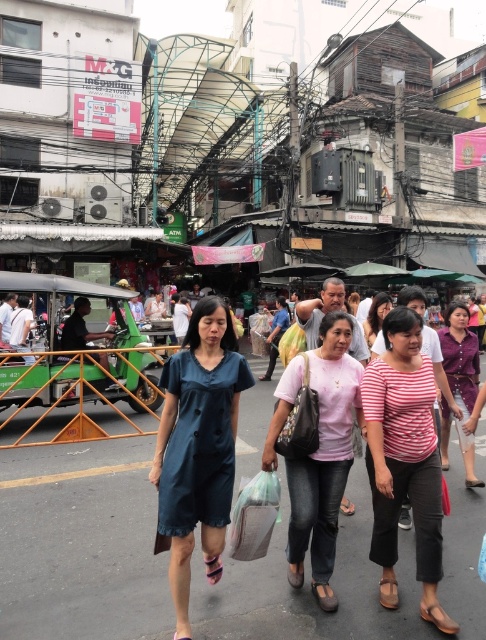
You are a street vendor trying to sell shirts to the two women in the center of the image. The striped cotton shirt at center and the pink cotton shirt at center are your best sellers. Which shirt should you approach first to maximize your sales?

You should approach the pink cotton shirt at center first because it is positioned to the left of the striped cotton shirt at center, making it closer to you from your vantage point as a vendor likely standing to the left of the scene.

You are standing at the point marked as point (x=197, y=448) in the image. What is the color of the dress worn by the woman closest to you?

The woman closest to you at point (x=197, y=448) is wearing a matte blue dress.